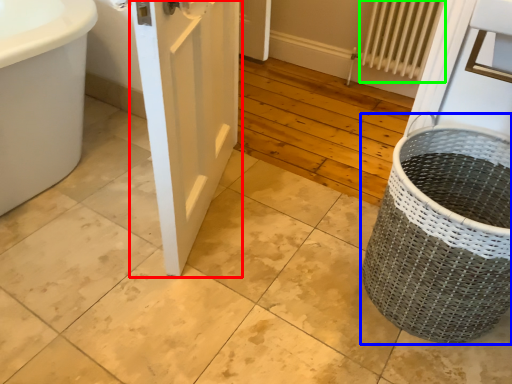
Question: Which is farther away from door (highlighted by a red box)? basket container (highlighted by a blue box) or radiator (highlighted by a green box)?

Choices:
 (A) basket container
 (B) radiator

Answer: (B)